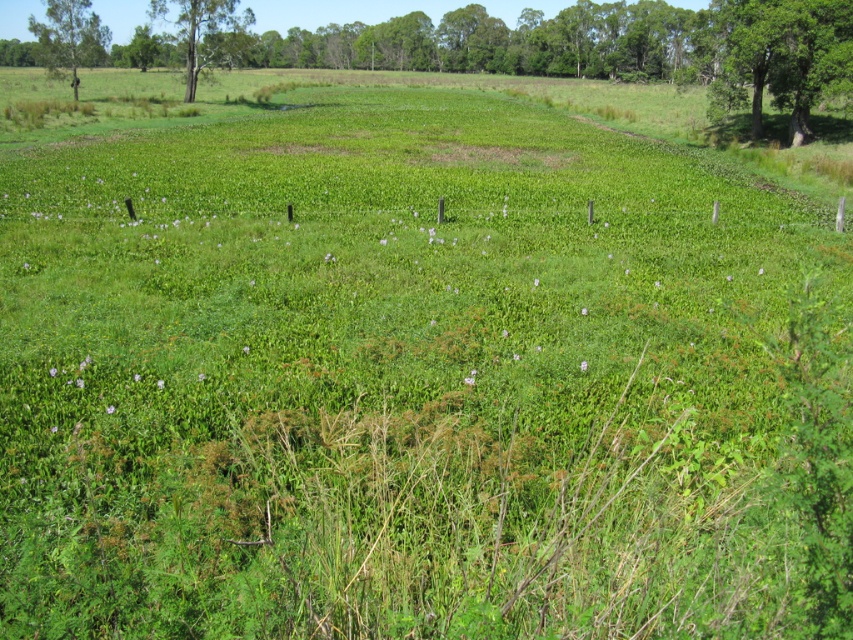
Question: Which object appears closest to the camera in this image?

Choices:
 (A) green leafy tree at upper left
 (B) smooth bark tree at upper left

Answer: (A)

Question: Considering the relative positions of smooth bark tree at upper left and green leafy tree at upper left in the image provided, where is smooth bark tree at upper left located with respect to green leafy tree at upper left?

Choices:
 (A) above
 (B) below

Answer: (B)

Question: Considering the real-world distances, which object is closest to the green leafy tree at upper right?

Choices:
 (A) green leafy tree at upper left
 (B) smooth bark tree at upper left

Answer: (B)

Question: Can you confirm if green leafy tree at upper right is wider than smooth bark tree at upper left?

Choices:
 (A) no
 (B) yes

Answer: (A)

Question: Is smooth bark tree at upper left wider than green leafy tree at upper left?

Choices:
 (A) no
 (B) yes

Answer: (A)

Question: Which point is farther from the camera taking this photo?

Choices:
 (A) (717, 77)
 (B) (97, 61)
 (C) (200, 42)

Answer: (B)